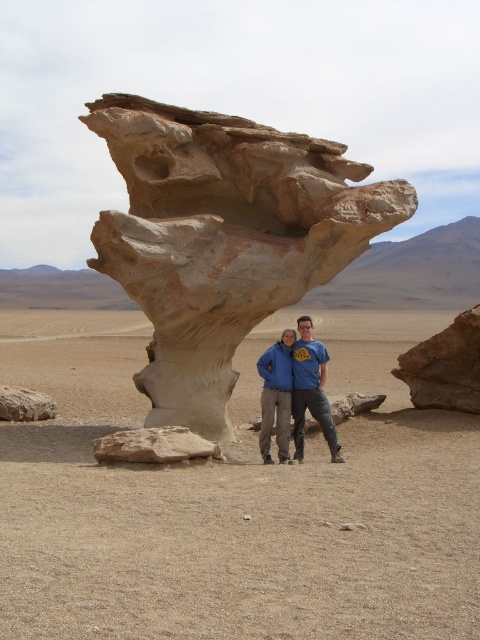
Question: Is brown rough rock at lower left wider than smooth beige rock at lower left?

Choices:
 (A) no
 (B) yes

Answer: (B)

Question: Can you confirm if smooth sandstone rock at center is positioned to the right of brown rough rock at lower left?

Choices:
 (A) no
 (B) yes

Answer: (B)

Question: Which of these objects is positioned closest to the brown rough rock at lower left?

Choices:
 (A) smooth sandstone rock at center
 (B) white sandstone rock formation at center

Answer: (A)

Question: Which point is closer to the camera?

Choices:
 (A) smooth sandstone rock at center
 (B) blue fabric couple at center

Answer: (A)

Question: Which of the following is the closest to the observer?

Choices:
 (A) blue fleece jacket at center
 (B) blue fabric couple at center

Answer: (B)

Question: Does brown rough rock at lower left appear on the right side of smooth beige rock at lower left?

Choices:
 (A) yes
 (B) no

Answer: (A)